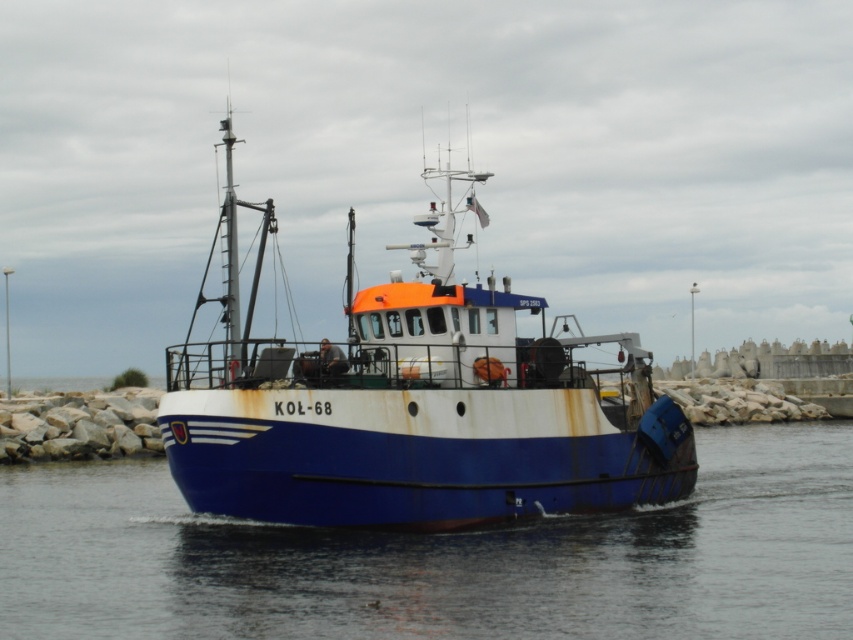
Question: Is blue smooth water at center to the right of rusty metal boat at center from the viewer's perspective?

Choices:
 (A) no
 (B) yes

Answer: (B)

Question: Is blue smooth water at center to the left of rusty metal boat at center from the viewer's perspective?

Choices:
 (A) yes
 (B) no

Answer: (B)

Question: Can you confirm if blue smooth water at center is positioned to the right of rusty metal boat at center?

Choices:
 (A) yes
 (B) no

Answer: (A)

Question: Which point is farther to the camera?

Choices:
 (A) blue smooth water at center
 (B) rusty metal boat at center

Answer: (B)